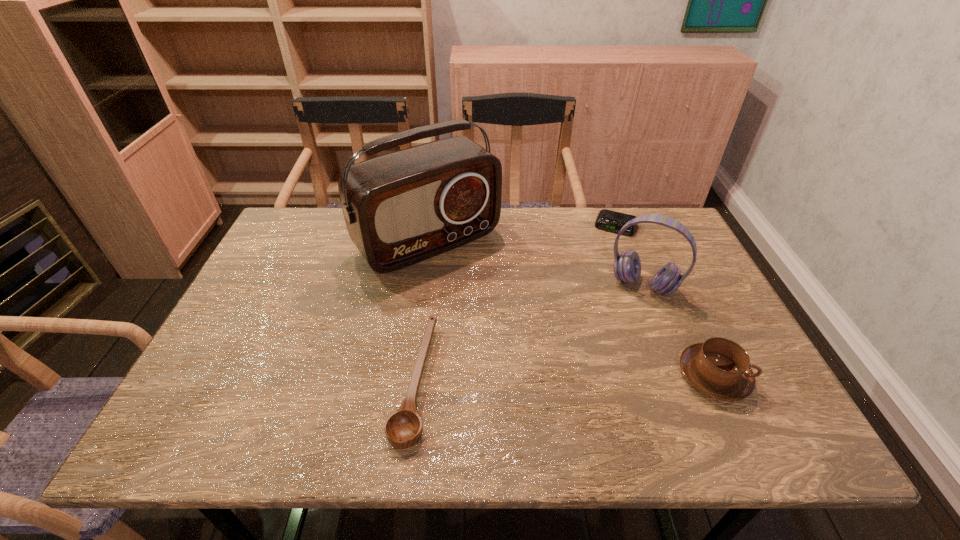
Find the location of a particular element. vacant space at the far right corner is located at coordinates (664, 238).

Find the location of a particular element. The height and width of the screenshot is (540, 960). free space that is in between the wooden spoon and the tallest object is located at coordinates (421, 312).

Identify the location of free space between the shortest object and the third tallest object. (664, 301).

Find the location of `vacant space that is in between the wooden spoon and the tallest object`. vacant space that is in between the wooden spoon and the tallest object is located at coordinates (421, 312).

Locate an element on the screen. free space between the alarm clock and the radio receiver is located at coordinates (522, 234).

In order to click on empty space between the second tallest object and the tallest object in this screenshot , I will do `click(536, 264)`.

Locate an element on the screen. This screenshot has height=540, width=960. vacant area that lies between the wooden spoon and the alarm clock is located at coordinates (515, 304).

The width and height of the screenshot is (960, 540). I want to click on free space that is in between the radio receiver and the second tallest object, so click(x=536, y=264).

Where is `free space between the wooden spoon and the radio receiver`? This screenshot has width=960, height=540. free space between the wooden spoon and the radio receiver is located at coordinates (421, 312).

Locate an element on the screen. This screenshot has height=540, width=960. vacant area between the tallest object and the cappuccino is located at coordinates (571, 309).